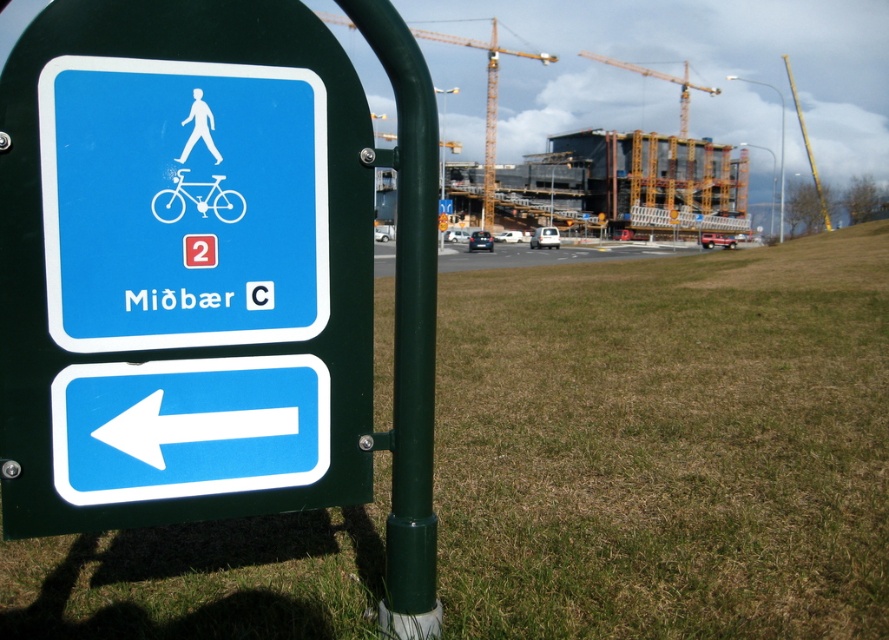
You are a delivery person trying to park your white glossy bicycle at center near the yellow metallic crane at upper center. Can you fit both items side by side in a space that is 2 meters wide?

The yellow metallic crane at upper center is larger than the white glossy bicycle at center. However, without knowing their exact dimensions, it is impossible to determine if they can fit side by side in a 2 meter wide space.

You are a cyclist approaching the blue plastic sign at left and the blue plastic arrow at lower left. Which object do you need to pass first?

You need to pass the blue plastic sign at left first because it is closer to you than the blue plastic arrow at lower left.

You are a cyclist approaching the blue pedestrian and bicycle path sign. You see the blue plastic arrow at lower left and the white glossy bicycle at center. Which object is located below the other?

The blue plastic arrow at lower left is positioned under the white glossy bicycle at center.